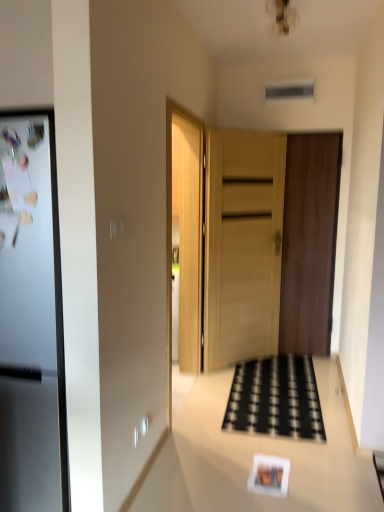
Question: From the image's perspective, is white glossy counter top at center located above matte paper postcard at lower center?

Choices:
 (A) yes
 (B) no

Answer: (A)

Question: Are white glossy counter top at center and matte paper postcard at lower center located far from each other?

Choices:
 (A) yes
 (B) no

Answer: (B)

Question: Is white glossy counter top at center wider than matte paper postcard at lower center?

Choices:
 (A) yes
 (B) no

Answer: (A)

Question: Is white glossy counter top at center thinner than matte paper postcard at lower center?

Choices:
 (A) yes
 (B) no

Answer: (B)

Question: From a real-world perspective, is white glossy counter top at center positioned over matte paper postcard at lower center based on gravity?

Choices:
 (A) no
 (B) yes

Answer: (B)

Question: Is dark brown wood door at center, the 1th door from the right, to the left or to the right of matte paper postcard at lower center in the image?

Choices:
 (A) left
 (B) right

Answer: (B)

Question: From the image's perspective, relative to matte paper postcard at lower center, is dark brown wood door at center, the 1th door from the right, above or below?

Choices:
 (A) below
 (B) above

Answer: (B)

Question: Which is correct: dark brown wood door at center, the second door viewed from the left, is inside matte paper postcard at lower center, or outside of it?

Choices:
 (A) inside
 (B) outside

Answer: (B)

Question: In terms of size, does dark brown wood door at center, the second door viewed from the left, appear bigger or smaller than matte paper postcard at lower center?

Choices:
 (A) big
 (B) small

Answer: (A)

Question: Would you say black woven mat at center is to the left or to the right of white glossy counter top at center in the picture?

Choices:
 (A) left
 (B) right

Answer: (B)

Question: Considering the positions of point (274, 380) and point (213, 392), is point (274, 380) closer or farther from the camera than point (213, 392)?

Choices:
 (A) closer
 (B) farther

Answer: (B)

Question: In the image, is black woven mat at center positioned in front of or behind white glossy counter top at center?

Choices:
 (A) front
 (B) behind

Answer: (B)

Question: Considering the positions of black woven mat at center and white glossy counter top at center in the image, is black woven mat at center wider or thinner than white glossy counter top at center?

Choices:
 (A) thin
 (B) wide

Answer: (A)

Question: From a real-world perspective, is black woven mat at center above or below dark brown wood door at center, the 1th door from the right?

Choices:
 (A) above
 (B) below

Answer: (B)

Question: From the image's perspective, is black woven mat at center positioned above or below dark brown wood door at center, the second door viewed from the left?

Choices:
 (A) above
 (B) below

Answer: (B)